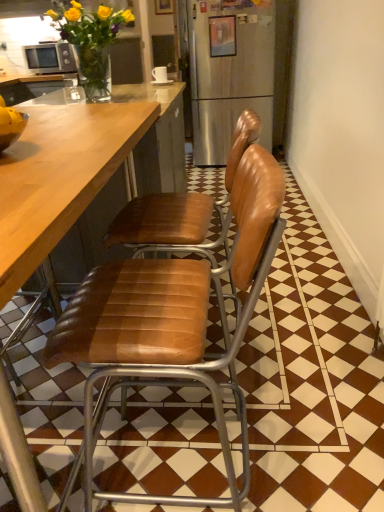
The image size is (384, 512). I want to click on brown leather chair at center, the 2th chair from the front, so click(x=183, y=210).

Where is `wooden picture frame at upper center, the 1th picture frame in the right-to-left sequence`? The height and width of the screenshot is (512, 384). wooden picture frame at upper center, the 1th picture frame in the right-to-left sequence is located at coordinates (222, 36).

What do you see at coordinates (222, 36) in the screenshot? I see `wooden picture frame at upper center, positioned as the 2th picture frame in top-to-bottom order` at bounding box center [222, 36].

Identify the location of leather at center, the second chair positioned from the back. (170, 326).

Describe the element at coordinates (160, 74) in the screenshot. The width and height of the screenshot is (384, 512). I see `white ceramic mug at upper center` at that location.

At what (x,y) coordinates should I click in order to perform the action: click on matte silver microwave at upper left. Please return your answer as a coordinate pair (x, y). Looking at the image, I should click on (50, 58).

This screenshot has height=512, width=384. What do you see at coordinates (50, 58) in the screenshot?
I see `matte silver microwave at upper left` at bounding box center [50, 58].

You are a GUI agent. You are given a task and a screenshot of the screen. Output one action in this format:
    pyautogui.click(x=<x>, y=<y>)
    Task: Click on the translucent glass vase at upper left
    The height and width of the screenshot is (512, 384).
    Given the screenshot: What is the action you would take?
    pyautogui.click(x=91, y=42)

Considering the relative positions of wooden picture frame at upper center, which is the 1th picture frame from back to front, and white ceramic mug at upper center in the image provided, is wooden picture frame at upper center, which is the 1th picture frame from back to front, to the left of white ceramic mug at upper center from the viewer's perspective?

Indeed, wooden picture frame at upper center, which is the 1th picture frame from back to front, is positioned on the left side of white ceramic mug at upper center.

From the image's perspective, does wooden picture frame at upper center, marked as the 2th picture frame in a right-to-left arrangement, appear higher than white ceramic mug at upper center?

Yes, from the image's perspective, wooden picture frame at upper center, marked as the 2th picture frame in a right-to-left arrangement, is on top of white ceramic mug at upper center.

Where is `coffee cup directly beneath the wooden picture frame at upper center, which is the 2th picture frame from front to back (from a real-world perspective)`? The height and width of the screenshot is (512, 384). coffee cup directly beneath the wooden picture frame at upper center, which is the 2th picture frame from front to back (from a real-world perspective) is located at coordinates (160, 74).

Is point (10, 139) more distant than point (61, 48)?

No.

Measure the distance from metallic silver bowl at left to matte silver microwave at upper left.

The distance of metallic silver bowl at left from matte silver microwave at upper left is 3.29 meters.

Is metallic silver bowl at left oriented towards matte silver microwave at upper left?

No.

Could you tell me if white ceramic mug at upper center is facing wooden picture frame at upper center, placed as the 2th picture frame when sorted from left to right?

No, white ceramic mug at upper center does not turn towards wooden picture frame at upper center, placed as the 2th picture frame when sorted from left to right.

Who is bigger, white ceramic mug at upper center or wooden picture frame at upper center, the 2th picture frame when ordered from back to front?

wooden picture frame at upper center, the 2th picture frame when ordered from back to front, is bigger.

Where is `coffee cup in front of the wooden picture frame at upper center, the 1th picture frame in the right-to-left sequence`? This screenshot has height=512, width=384. coffee cup in front of the wooden picture frame at upper center, the 1th picture frame in the right-to-left sequence is located at coordinates (160, 74).

Visually, is white ceramic mug at upper center positioned to the left or to the right of wooden picture frame at upper center, the 2th picture frame when ordered from back to front?

Clearly, white ceramic mug at upper center is on the left of wooden picture frame at upper center, the 2th picture frame when ordered from back to front, in the image.

Is wooden picture frame at upper center, which is the 1th picture frame from back to front, further to the viewer compared to brown leather chair at center, which ranks as the 1th chair in back-to-front order?

Yes, wooden picture frame at upper center, which is the 1th picture frame from back to front, is behind brown leather chair at center, which ranks as the 1th chair in back-to-front order.

Is wooden picture frame at upper center, the 1th picture frame viewed from the left, with brown leather chair at center, which ranks as the 1th chair in back-to-front order?

No, wooden picture frame at upper center, the 1th picture frame viewed from the left, is not with brown leather chair at center, which ranks as the 1th chair in back-to-front order.

From the image's perspective, is wooden picture frame at upper center, which is the 1th picture frame from back to front, over brown leather chair at center, which ranks as the 1th chair in back-to-front order?

Correct, wooden picture frame at upper center, which is the 1th picture frame from back to front, appears higher than brown leather chair at center, which ranks as the 1th chair in back-to-front order, in the image.

Can you tell me how much wooden picture frame at upper center, the 1th picture frame in the top-to-bottom sequence, and brown leather chair at center, the 2th chair from the front, differ in facing direction?

92.1 degrees.

Do you think wooden picture frame at upper center, which is the 2th picture frame from front to back, is within metallic silver bowl at left, or outside of it?

wooden picture frame at upper center, which is the 2th picture frame from front to back, lies outside metallic silver bowl at left.

Is wooden picture frame at upper center, the 1th picture frame in the top-to-bottom sequence, thinner than metallic silver bowl at left?

Correct, the width of wooden picture frame at upper center, the 1th picture frame in the top-to-bottom sequence, is less than that of metallic silver bowl at left.

Does wooden picture frame at upper center, which is the 2th picture frame from front to back, have a greater height compared to metallic silver bowl at left?

Correct, wooden picture frame at upper center, which is the 2th picture frame from front to back, is much taller as metallic silver bowl at left.

Does wooden picture frame at upper center, the 1th picture frame in the top-to-bottom sequence, have a larger size compared to metallic silver bowl at left?

Indeed, wooden picture frame at upper center, the 1th picture frame in the top-to-bottom sequence, has a larger size compared to metallic silver bowl at left.

This screenshot has width=384, height=512. In order to click on the 1st chair in front of the matte silver microwave at upper left in this screenshot , I will do `click(183, 210)`.

From a real-world perspective, does matte silver microwave at upper left sit lower than brown leather chair at center, the 2th chair from the front?

Incorrect, from a real-world perspective, matte silver microwave at upper left is higher than brown leather chair at center, the 2th chair from the front.

Considering the relative positions of matte silver microwave at upper left and brown leather chair at center, the 2th chair from the front, in the image provided, is matte silver microwave at upper left to the left or to the right of brown leather chair at center, the 2th chair from the front,?

matte silver microwave at upper left is positioned on brown leather chair at center, the 2th chair from the front,'s left side.

Is matte silver microwave at upper left wider than brown leather chair at center, the 2th chair from the front?

Incorrect, the width of matte silver microwave at upper left does not surpass that of brown leather chair at center, the 2th chair from the front.

Can you confirm if matte silver microwave at upper left is smaller than translucent glass vase at upper left?

Yes, matte silver microwave at upper left is smaller than translucent glass vase at upper left.

In terms of height, does matte silver microwave at upper left look taller or shorter compared to translucent glass vase at upper left?

Clearly, matte silver microwave at upper left is shorter compared to translucent glass vase at upper left.

Is matte silver microwave at upper left surrounding translucent glass vase at upper left?

Definitely not — translucent glass vase at upper left is not inside matte silver microwave at upper left.

Is matte silver microwave at upper left oriented towards translucent glass vase at upper left?

Yes, matte silver microwave at upper left is oriented towards translucent glass vase at upper left.

Where is `picture frame lying on the left of white ceramic mug at upper center`? picture frame lying on the left of white ceramic mug at upper center is located at coordinates (163, 7).

I want to click on microwave oven located above the metallic silver bowl at left (from the image's perspective), so click(x=50, y=58).

Looking at the image, which one is located closer to matte silver microwave at upper left, brown leather chair at center, the 2th chair from the front, or wooden picture frame at upper center, which appears as the 2th picture frame when ordered from the bottom?

wooden picture frame at upper center, which appears as the 2th picture frame when ordered from the bottom, lies closer to matte silver microwave at upper left than the other object.

From the image, which object appears to be farther from matte silver microwave at upper left, white ceramic mug at upper center or wooden picture frame at upper center, the 1th picture frame in the top-to-bottom sequence?

The object further to matte silver microwave at upper left is white ceramic mug at upper center.

When comparing their distances from wooden picture frame at upper center, which is the 2th picture frame from front to back, does white ceramic mug at upper center or metallic silver bowl at left seem closer?

white ceramic mug at upper center is closer to wooden picture frame at upper center, which is the 2th picture frame from front to back.

Estimate the real-world distances between objects in this image. Which object is closer to metallic silver bowl at left, wooden picture frame at upper center, placed as the 2th picture frame when sorted from left to right, or white ceramic mug at upper center?

white ceramic mug at upper center.

Considering their positions, is matte silver microwave at upper left positioned further to brown leather chair at center, the 2th chair from the front, than metallic silver bowl at left?

matte silver microwave at upper left lies further to brown leather chair at center, the 2th chair from the front, than the other object.

Estimate the real-world distances between objects in this image. Which object is closer to wooden picture frame at upper center, the 1th picture frame in the top-to-bottom sequence, wooden picture frame at upper center, the 1th picture frame in the right-to-left sequence, or white ceramic mug at upper center?

The object closer to wooden picture frame at upper center, the 1th picture frame in the top-to-bottom sequence, is wooden picture frame at upper center, the 1th picture frame in the right-to-left sequence.

Which object lies further to the anchor point wooden picture frame at upper center, the 1th picture frame in the front-to-back sequence, leather at center, which appears as the 1th chair when viewed from the front, or white ceramic mug at upper center?

leather at center, which appears as the 1th chair when viewed from the front, is positioned further to the anchor wooden picture frame at upper center, the 1th picture frame in the front-to-back sequence.

Looking at the image, which one is located closer to translucent glass vase at upper left, leather at center, which appears as the 1th chair when viewed from the front, or brown leather chair at center, which ranks as the 1th chair in back-to-front order?

brown leather chair at center, which ranks as the 1th chair in back-to-front order, lies closer to translucent glass vase at upper left than the other object.

This screenshot has height=512, width=384. Find the location of `houseplant located between leather at center, which appears as the 1th chair when viewed from the front, and wooden picture frame at upper center, which is the 1th picture frame from back to front, in the depth direction`. houseplant located between leather at center, which appears as the 1th chair when viewed from the front, and wooden picture frame at upper center, which is the 1th picture frame from back to front, in the depth direction is located at coordinates (91, 42).

What are the coordinates of `bowl between leather at center, which appears as the 1th chair when viewed from the front, and white ceramic mug at upper center, along the z-axis` in the screenshot? It's located at (12, 131).

This screenshot has height=512, width=384. Identify the location of coffee cup between brown leather chair at center, which ranks as the 1th chair in back-to-front order, and wooden picture frame at upper center, positioned as the 2th picture frame in top-to-bottom order, along the z-axis. (160, 74).

Locate an element on the screen. This screenshot has height=512, width=384. microwave oven between leather at center, which appears as the 1th chair when viewed from the front, and wooden picture frame at upper center, marked as the 2th picture frame in a right-to-left arrangement, along the z-axis is located at coordinates (50, 58).